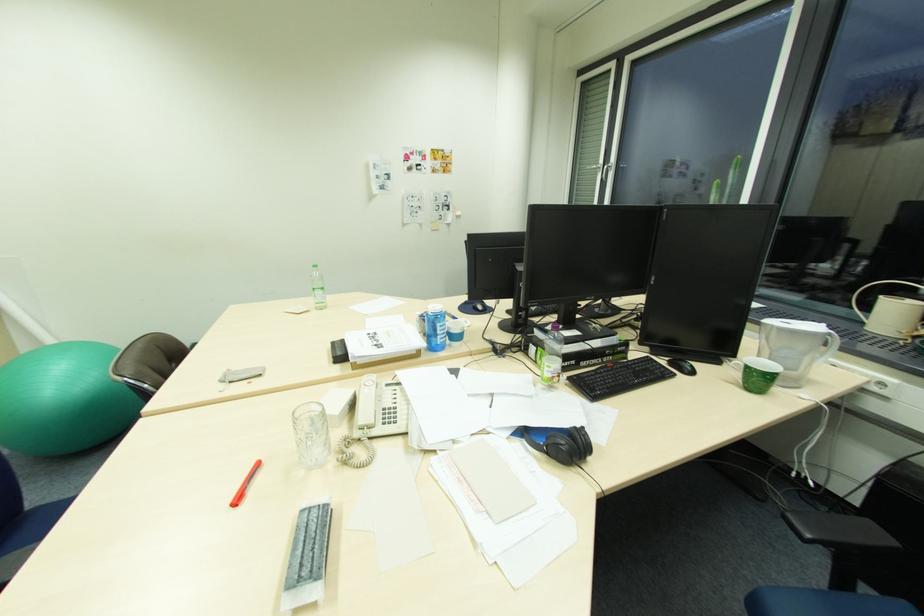
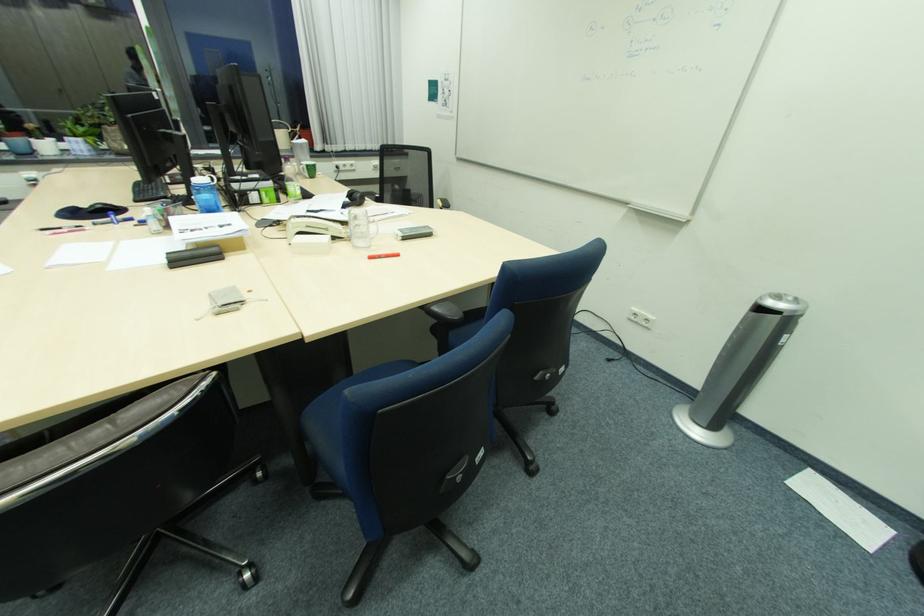
In the second image, find the point that corresponds to point (516, 434) in the first image.

(349, 209)